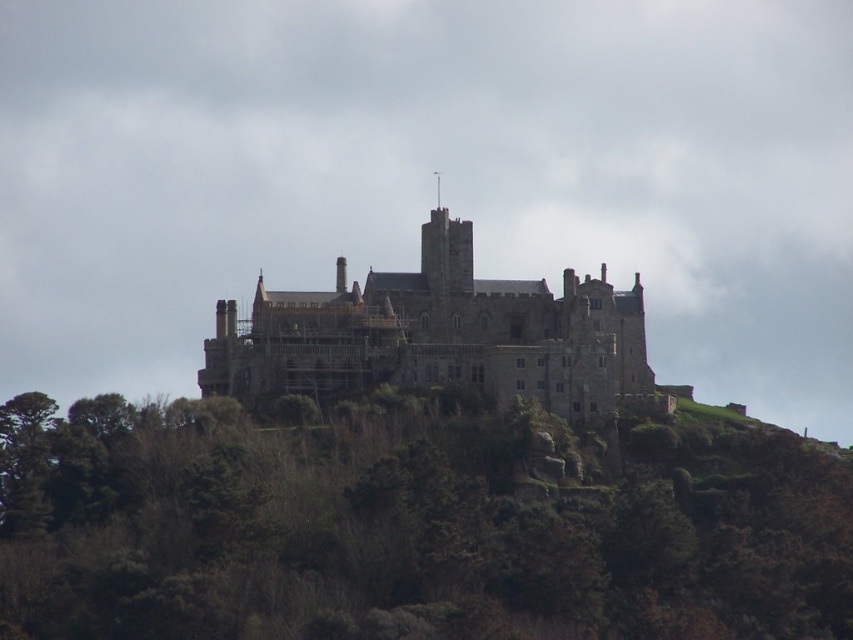
You are a visitor standing at the base of the hill looking up at the stone castle at center. You notice a green leafy tree at center in the foreground. Which object is closer to you?

The green leafy tree at center is closer to you because it is positioned below the stone castle at center, indicating it is in the foreground.

You are standing at the base of the hill where the castle is located. You see a point marked at coordinates (x=409, y=529). What is the object located at this point?

The point at coordinates (x=409, y=529) marks a green leafy tree at center.

You are a visitor standing at the base of the hill looking up at the stone castle at center. You notice a green leafy tree at center in the foreground. From your perspective, which object is closer to you?

The green leafy tree at center is closer to you because it is positioned on the right side of the stone castle at center, which is further up the hill.